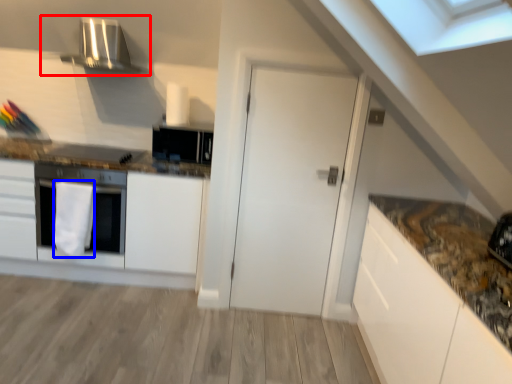
Question: Which object appears closest to the camera in this image, exhaust hood (highlighted by a red box) or material (highlighted by a blue box)?

Choices:
 (A) exhaust hood
 (B) material

Answer: (B)